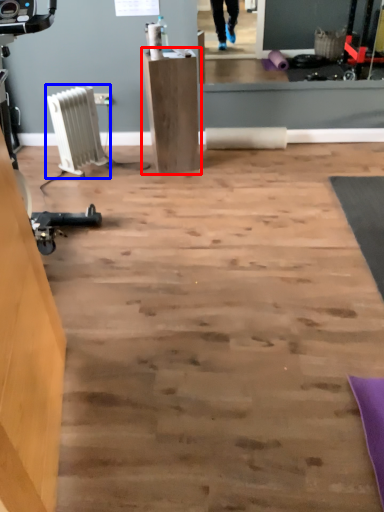
Question: Among these objects, which one is nearest to the camera, furniture (highlighted by a red box) or radiator (highlighted by a blue box)?

Choices:
 (A) furniture
 (B) radiator

Answer: (A)